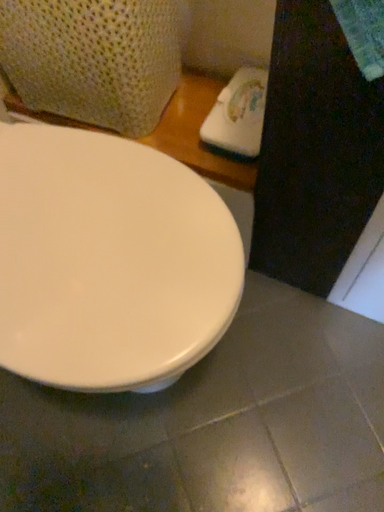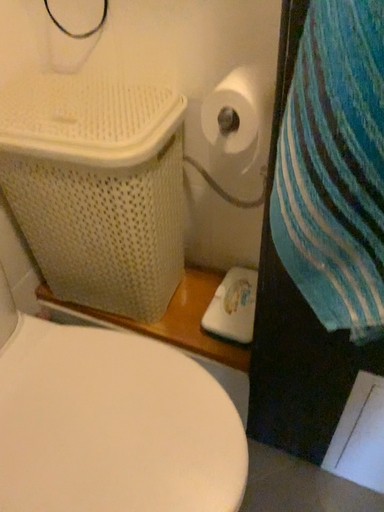
Question: How did the camera likely rotate when shooting the video?

Choices:
 (A) rotated downward
 (B) rotated upward

Answer: (B)